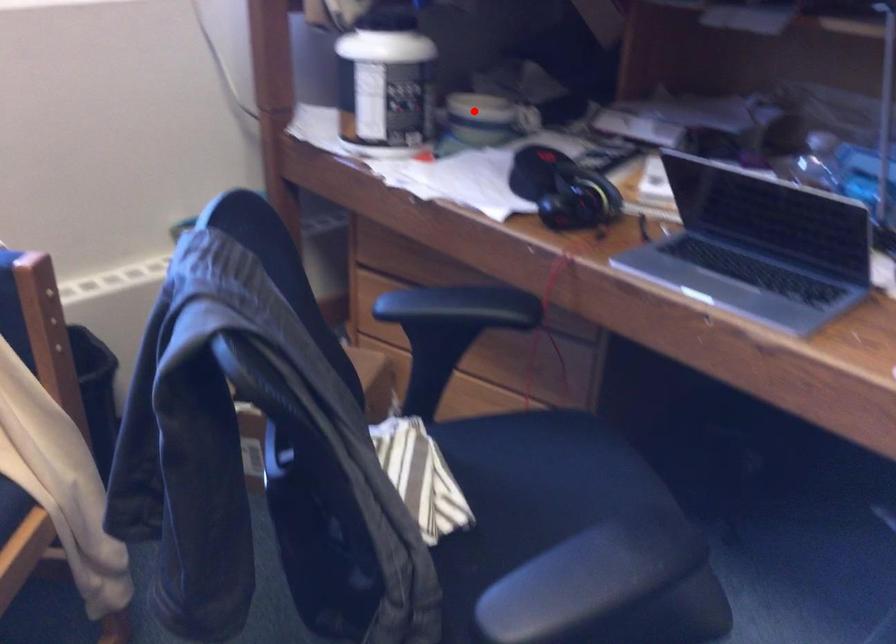
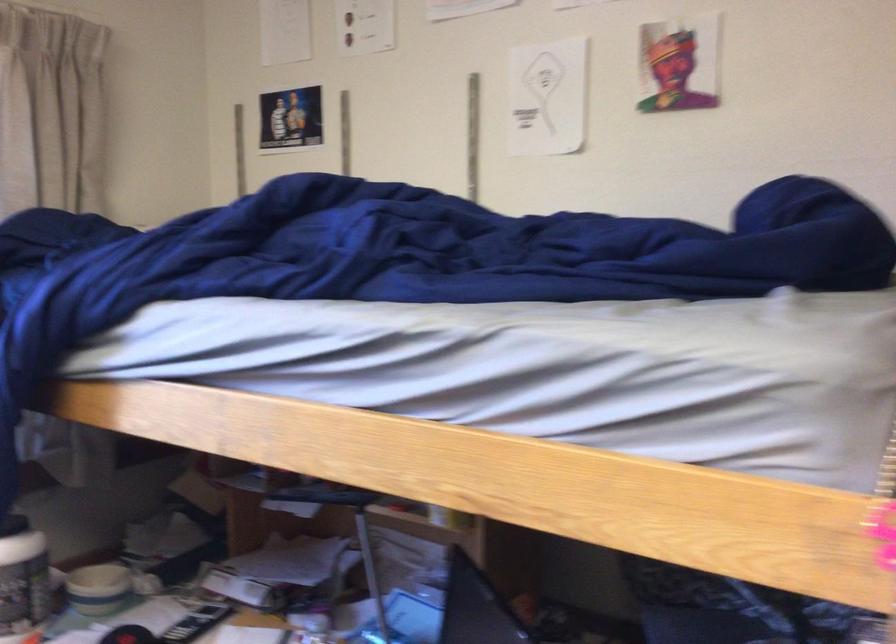
Locate, in the second image, the point that corresponds to the highlighted location in the first image.

(98, 589)